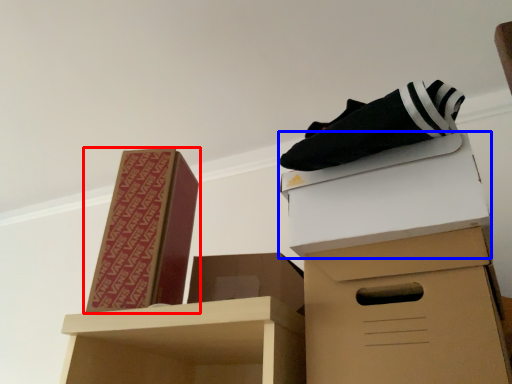
Question: Which of the following is the farthest to the observer, box (highlighted by a red box) or box (highlighted by a blue box)?

Choices:
 (A) box
 (B) box

Answer: (A)